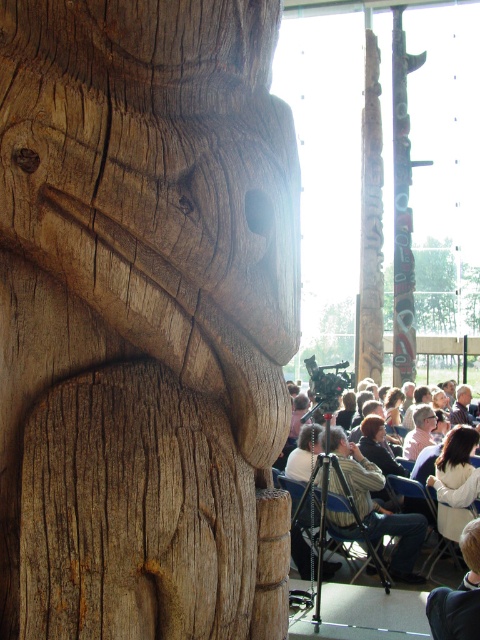
Is point (340, 513) behind point (468, 540)?

Yes, it is behind point (468, 540).

Between matte wooden crowd at center and light brown wood carving at lower right, which one is positioned higher?

light brown wood carving at lower right is above.

Does point (399, 611) lie behind point (428, 605)?

That is True.

At what (x,y) coordinates should I click in order to perform the action: click on matte wooden crowd at center. Please return your answer as a coordinate pair (x, y). This screenshot has width=480, height=640. Looking at the image, I should click on (339, 620).

I want to click on light brown wood chair at center, so click(380, 508).

Which is below, light brown wood chair at center or light brown wood carving at lower right?

light brown wood chair at center is lower down.

The width and height of the screenshot is (480, 640). What do you see at coordinates (380, 508) in the screenshot? I see `light brown wood chair at center` at bounding box center [380, 508].

Where is `light brown wood chair at center`? light brown wood chair at center is located at coordinates (380, 508).

Is point (408, 154) positioned before point (307, 637)?

That is False.

Between carved wood totem pole at center and matte wooden crowd at center, which one has less height?

matte wooden crowd at center is shorter.

Describe the element at coordinates (402, 209) in the screenshot. I see `carved wood totem pole at center` at that location.

The width and height of the screenshot is (480, 640). I want to click on carved wood totem pole at center, so click(x=402, y=209).